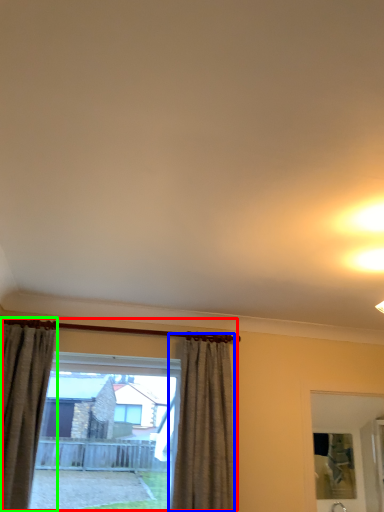
Question: Considering the real-world distances, which object is closest to window (highlighted by a red box)? curtain (highlighted by a blue box) or curtain (highlighted by a green box).

Choices:
 (A) curtain
 (B) curtain

Answer: (A)